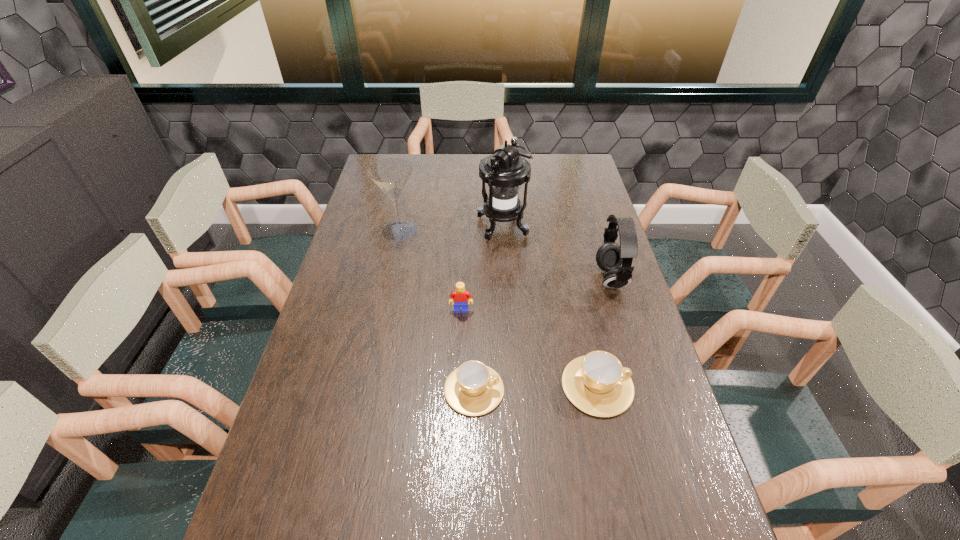
In order to click on vacant place for an extra cup on the left in this screenshot , I will do `click(348, 394)`.